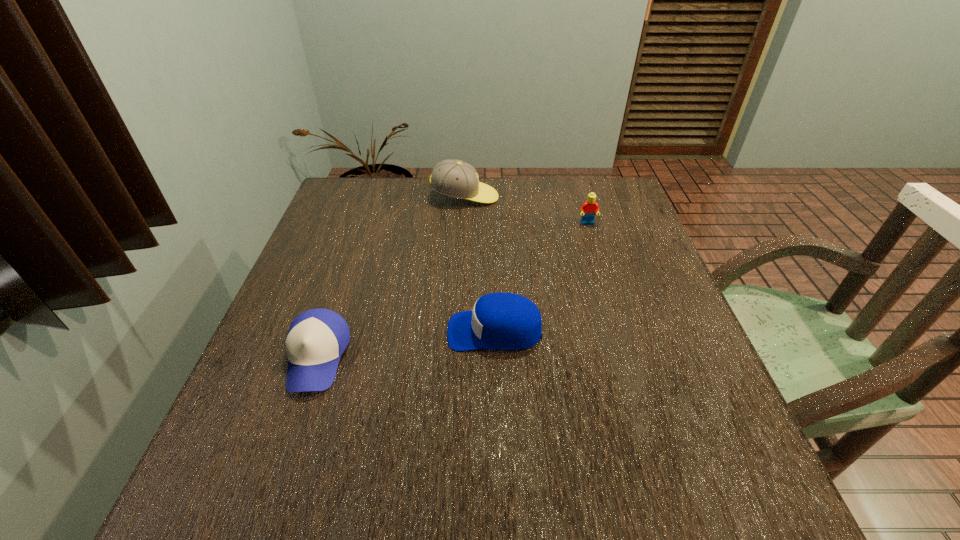
Image resolution: width=960 pixels, height=540 pixels. I want to click on vacant area that lies between the second farthest object and the tallest object, so click(526, 210).

The width and height of the screenshot is (960, 540). Find the location of `free space between the leftmost object and the rightmost object`. free space between the leftmost object and the rightmost object is located at coordinates (452, 291).

Locate an element on the screen. vacant space that's between the tallest object and the third nearest object is located at coordinates (526, 210).

At what (x,y) coordinates should I click in order to perform the action: click on free point between the farthest object and the second farthest object. Please return your answer as a coordinate pair (x, y). The width and height of the screenshot is (960, 540). Looking at the image, I should click on click(526, 210).

In order to click on unoccupied position between the farthest baseball cap and the rightmost object in this screenshot , I will do `click(526, 210)`.

I want to click on free spot between the leftmost object and the tallest baseball cap, so click(391, 277).

Find the location of a particular element. free spot between the farthest baseball cap and the Lego is located at coordinates (526, 210).

Locate which object ranks third in proximity to the farthest object. Please provide its 2D coordinates. Your answer should be formatted as a tuple, i.e. [(x, y)], where the tuple contains the x and y coordinates of a point satisfying the conditions above.

[(316, 339)]

Where is `object that stands as the second closest to the second farthest object`? This screenshot has width=960, height=540. object that stands as the second closest to the second farthest object is located at coordinates (499, 321).

Point out which baseball cap is positioned as the nearest to the second farthest object. Please provide its 2D coordinates. Your answer should be formatted as a tuple, i.e. [(x, y)], where the tuple contains the x and y coordinates of a point satisfying the conditions above.

[(457, 179)]